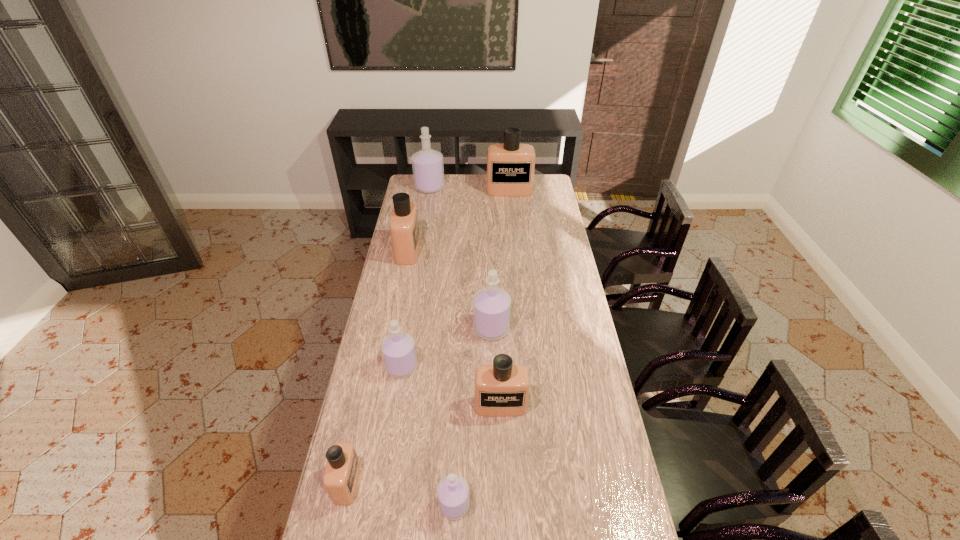
Locate an element on the screen. The width and height of the screenshot is (960, 540). the farthest purple perfume is located at coordinates (427, 164).

At what (x,y) coordinates should I click in order to perform the action: click on the farthest beige perfume. Please return your answer as a coordinate pair (x, y). The width and height of the screenshot is (960, 540). Looking at the image, I should click on (510, 166).

This screenshot has height=540, width=960. I want to click on the second biggest beige perfume, so click(x=404, y=227).

Identify the location of the sixth nearest object. The height and width of the screenshot is (540, 960). (404, 227).

Locate an element on the screen. the fifth nearest perfume is located at coordinates (491, 305).

Find the location of a particular element. the third nearest purple perfume is located at coordinates (491, 305).

Locate an element on the screen. This screenshot has height=540, width=960. the second nearest purple perfume is located at coordinates point(398,350).

Find the location of a particular element. The width and height of the screenshot is (960, 540). the fourth nearest perfume is located at coordinates (398, 350).

Locate an element on the screen. This screenshot has height=540, width=960. the sixth farthest perfume is located at coordinates (501, 389).

Find the location of a particular element. The height and width of the screenshot is (540, 960). the sixth farthest object is located at coordinates (501, 389).